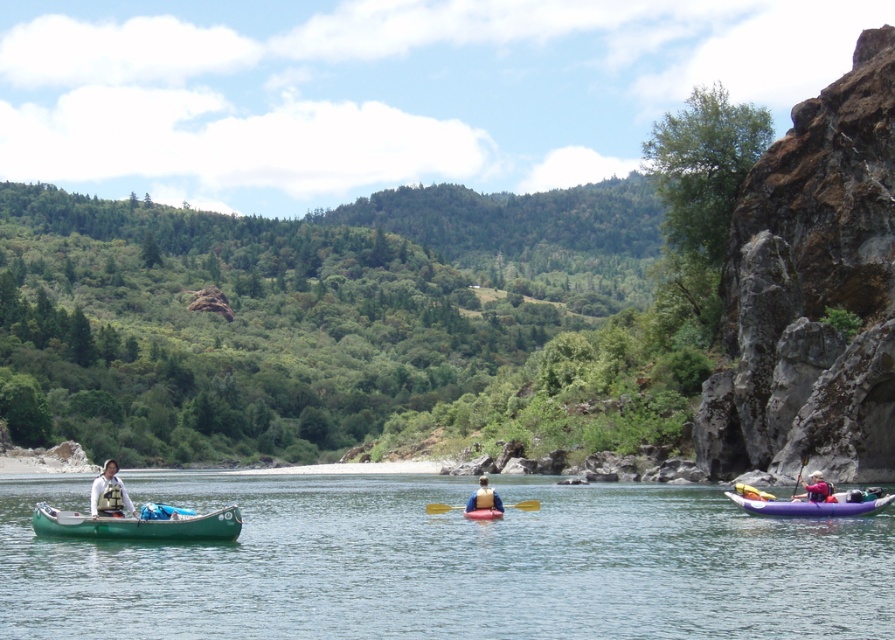
Question: Can you confirm if matte yellow life vest at center is thinner than wooden paddle at center?

Choices:
 (A) no
 (B) yes

Answer: (B)

Question: Which of the following is the closest to the observer?

Choices:
 (A) (885, 500)
 (B) (444, 509)

Answer: (A)

Question: Does white fabric shirt at left appear on the left side of wooden paddle at center?

Choices:
 (A) no
 (B) yes

Answer: (B)

Question: Can you confirm if green rubber canoe at left is positioned to the left of rubber kayak at center?

Choices:
 (A) yes
 (B) no

Answer: (A)

Question: Which point appears farthest from the camera in this image?

Choices:
 (A) (467, 500)
 (B) (195, 531)
 (C) (802, 465)

Answer: (C)

Question: Among these objects, which one is nearest to the camera?

Choices:
 (A) yellow plastic paddle at center
 (B) green rubber canoe at left
 (C) green matte canoe at left
 (D) wooden paddle at center

Answer: (B)